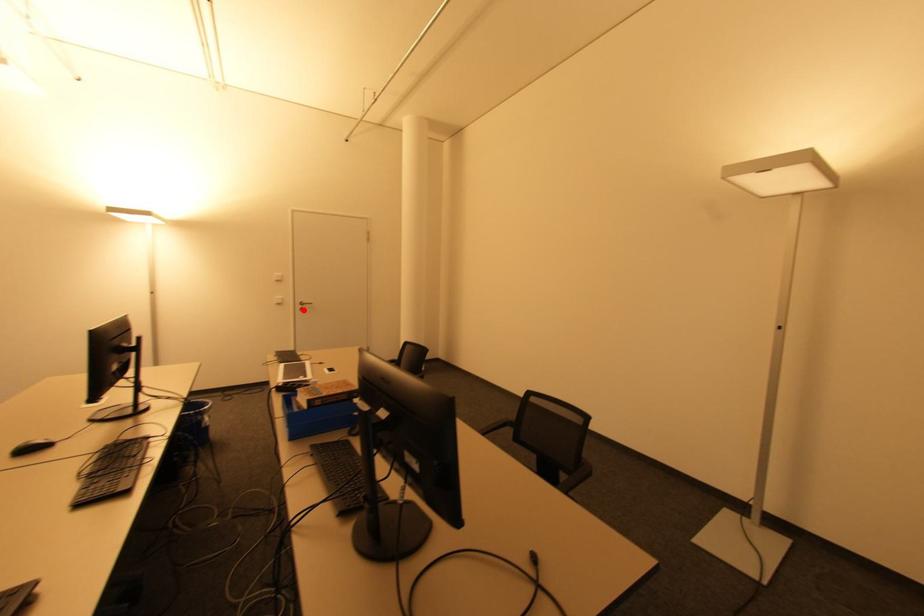
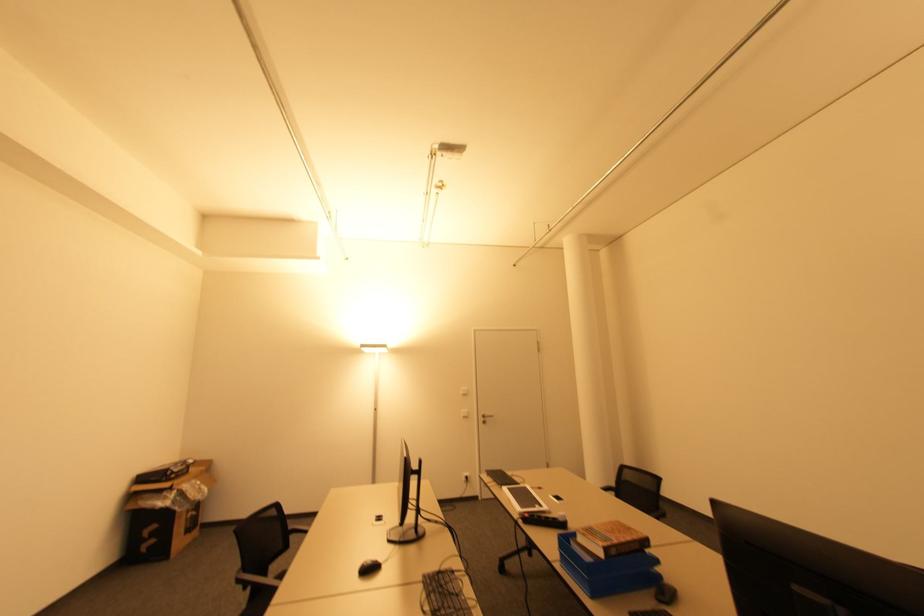
Locate, in the second image, the point that corresponds to the highlighted location in the first image.

(485, 422)